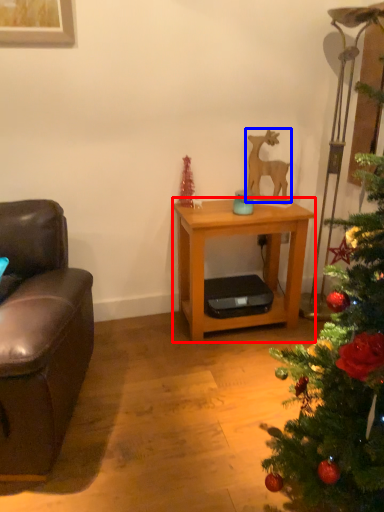
Question: Among these objects, which one is nearest to the camera, desk (highlighted by a red box) or animal (highlighted by a blue box)?

Choices:
 (A) desk
 (B) animal

Answer: (A)